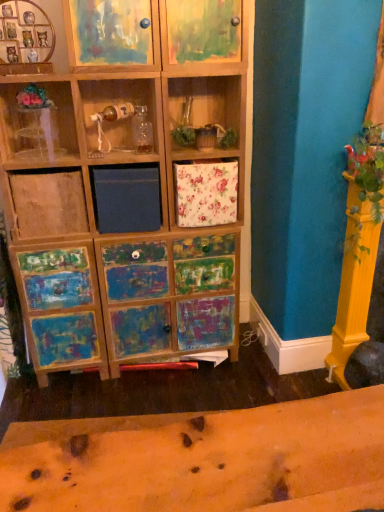
Question: Is the position of painted wood cabinet at upper left, marked as the 2th cabinet in a right-to-left arrangement, more distant than that of painted wood cabinet at upper center, the 2th cabinet positioned from the left?

Choices:
 (A) yes
 (B) no

Answer: (B)

Question: Considering the relative sizes of painted wood cabinet at upper left, the 1th cabinet viewed from the left, and painted wood cabinet at upper center, the first cabinet from the right, in the image provided, is painted wood cabinet at upper left, the 1th cabinet viewed from the left, shorter than painted wood cabinet at upper center, the first cabinet from the right,?

Choices:
 (A) yes
 (B) no

Answer: (B)

Question: Is painted wood cabinet at upper left, marked as the 2th cabinet in a right-to-left arrangement, at the right side of painted wood cabinet at upper center, the 2th cabinet positioned from the left?

Choices:
 (A) no
 (B) yes

Answer: (A)

Question: Does painted wood cabinet at upper left, the 1th cabinet viewed from the left, have a smaller size compared to painted wood cabinet at upper center, the first cabinet from the right?

Choices:
 (A) yes
 (B) no

Answer: (A)

Question: Does painted wood cabinet at upper left, marked as the 2th cabinet in a right-to-left arrangement, have a lesser width compared to painted wood cabinet at upper center, the 2th cabinet positioned from the left?

Choices:
 (A) yes
 (B) no

Answer: (A)

Question: Is painted wood cabinet at upper left, marked as the 2th cabinet in a right-to-left arrangement, turned away from painted wood cabinet at upper center, the 2th cabinet positioned from the left?

Choices:
 (A) yes
 (B) no

Answer: (B)

Question: Is painted wood cabinet at upper left, the 1th cabinet viewed from the left, wider than transparent plastic vase at upper left?

Choices:
 (A) yes
 (B) no

Answer: (A)

Question: Does painted wood cabinet at upper left, marked as the 2th cabinet in a right-to-left arrangement, appear on the right side of transparent plastic vase at upper left?

Choices:
 (A) yes
 (B) no

Answer: (A)

Question: Is painted wood cabinet at upper left, the 1th cabinet viewed from the left, shorter than transparent plastic vase at upper left?

Choices:
 (A) yes
 (B) no

Answer: (B)

Question: From the image's perspective, is painted wood cabinet at upper left, the 1th cabinet viewed from the left, located above transparent plastic vase at upper left?

Choices:
 (A) yes
 (B) no

Answer: (A)

Question: Can you confirm if painted wood cabinet at upper left, marked as the 2th cabinet in a right-to-left arrangement, is positioned to the left of transparent plastic vase at upper left?

Choices:
 (A) no
 (B) yes

Answer: (A)

Question: Does painted wood cabinet at upper left, marked as the 2th cabinet in a right-to-left arrangement, have a greater height compared to transparent plastic vase at upper left?

Choices:
 (A) no
 (B) yes

Answer: (B)

Question: Does transparent plastic vase at upper left have a lesser height compared to painted wood cabinet at upper left, the 1th cabinet viewed from the left?

Choices:
 (A) yes
 (B) no

Answer: (A)